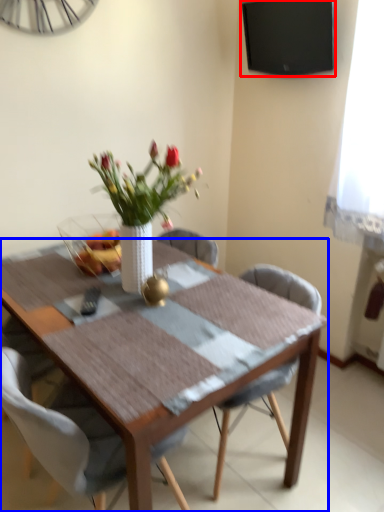
Question: Among these objects, which one is nearest to the camera, television (highlighted by a red box) or kitchen & dining room table (highlighted by a blue box)?

Choices:
 (A) television
 (B) kitchen & dining room table

Answer: (B)